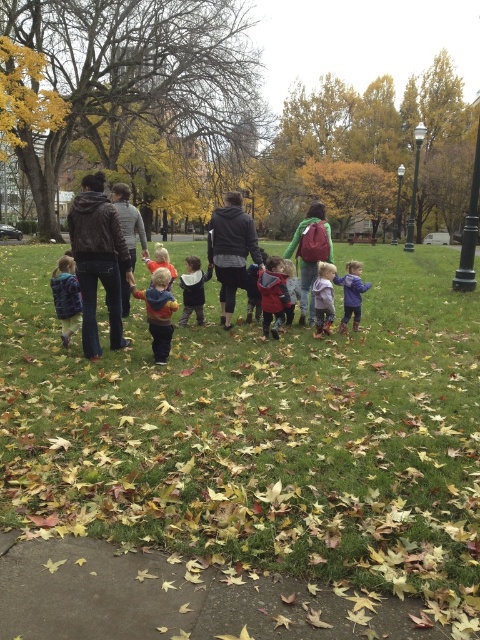
Question: Which of these objects is positioned closest to the matte black jacket at center?

Choices:
 (A) leather jacket at center
 (B) matte blue jacket at center
 (C) dark gray hoodie at center

Answer: (A)

Question: Which object is closer to the camera taking this photo?

Choices:
 (A) green grass at center
 (B) matte blue hoodie at center

Answer: (A)

Question: Which of these objects is positioned closest to the green grass at center?

Choices:
 (A) fluffy blue jacket at lower left
 (B) flannel shirt at center
 (C) matte blue hoodie at center
 (D) concrete pavement at lower left

Answer: (C)

Question: Can you confirm if concrete pavement at lower left is positioned below matte black jacket at center?

Choices:
 (A) yes
 (B) no

Answer: (A)

Question: Is matte red jacket at center smaller than white fleece jacket at center?

Choices:
 (A) yes
 (B) no

Answer: (A)

Question: Observing the image, what is the correct spatial positioning of concrete pavement at lower left in reference to dark gray hoodie at center?

Choices:
 (A) right
 (B) left

Answer: (B)